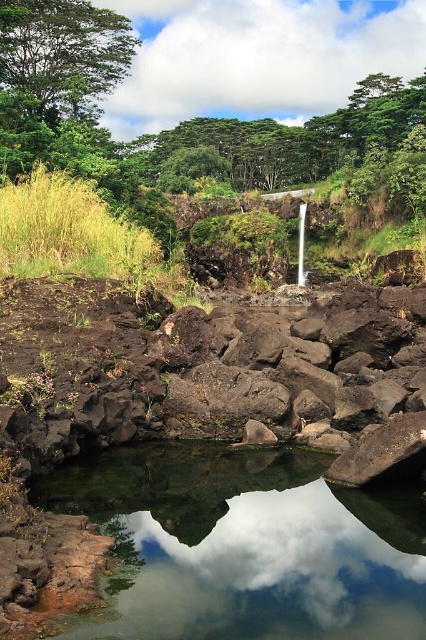
You are a photographer standing at the camera position. You want to capture a closeup shot of the clear water at center. Can you step forward to get closer without moving the camera tripod? The tripod is 1.2 meters tall and you can only move within the 2 meters range from your current position.

The clear water at center and camera are 3.83 meters apart from each other. Since you can only move within 2 meters from your current position, stepping forward would only reduce the distance to 1.83 meters. However, the tripod is 1.2 meters tall, so the minimum safe distance to avoid blocking the shot is at least 1.2 meters. Therefore, you can move closer to 1.83 meters, which is still safe and allows for a closer shot.

You are standing at the edge of the pool below the waterfall. There is a point marked at coordinates (245,545) in the image. Is this point located in the clear water at center?

The clear water at center is represented by point (245,545), so yes, the point is located in the clear water at center.